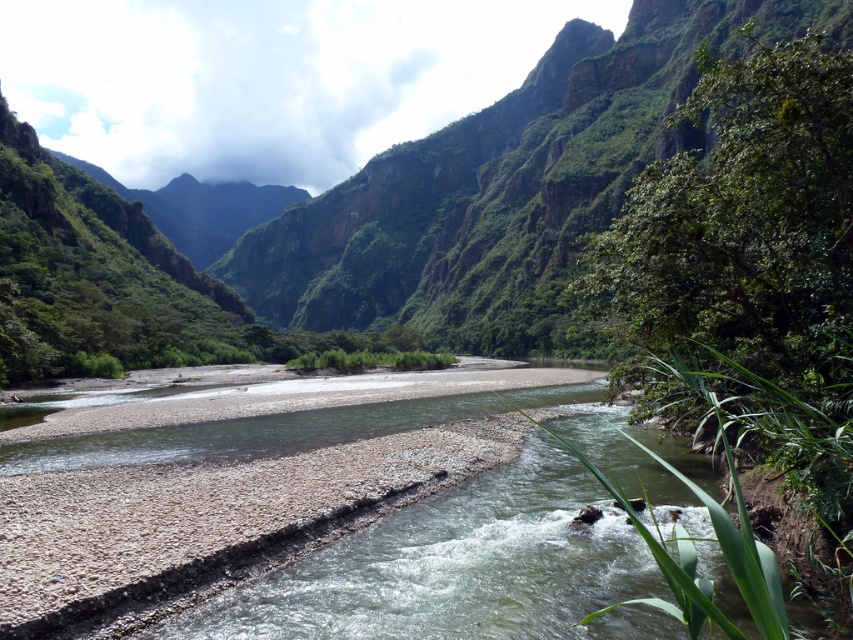
Which is above, green leafy tree at right or green rocky mountain at center?

green rocky mountain at center

Is green leafy tree at right closer to the viewer compared to green rocky mountain at center?

Yes.

Which is behind, point (805, 380) or point (260, 243)?

The point (260, 243) is more distant.

Where is `green leafy tree at right`? green leafy tree at right is located at coordinates (747, 285).